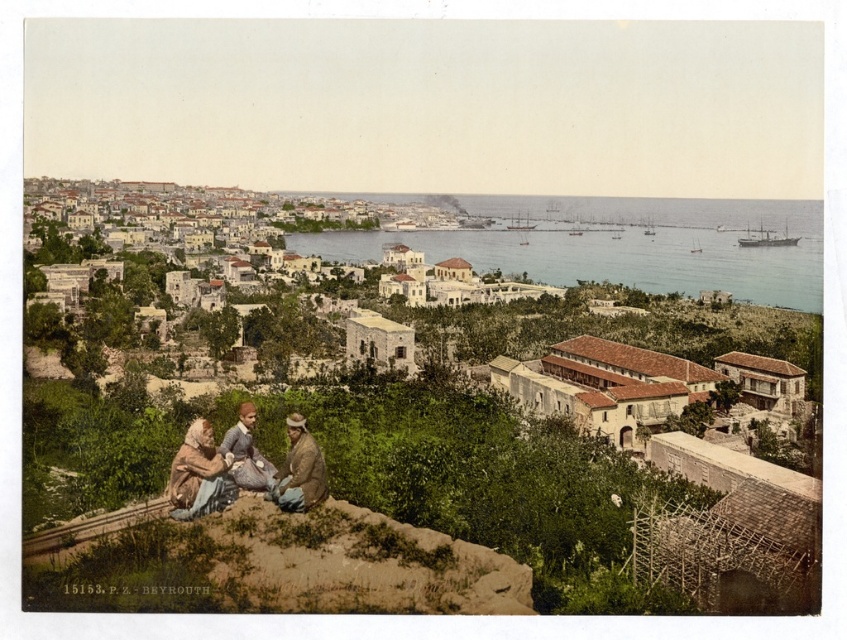
Question: Estimate the real-world distances between objects in this image. Which object is closer to the brown leather jacket at lower left?

Choices:
 (A) light beige stone buildings at center
 (B) blue water at center
 (C) brown leather hat at center

Answer: (C)

Question: Observing the image, what is the correct spatial positioning of light beige stone buildings at center in reference to matte blue dress at lower left?

Choices:
 (A) below
 (B) above

Answer: (B)

Question: Does light beige stone buildings at center come in front of matte blue dress at lower left?

Choices:
 (A) yes
 (B) no

Answer: (B)

Question: Among these objects, which one is farthest from the camera?

Choices:
 (A) matte blue dress at lower left
 (B) brown leather jacket at lower left
 (C) brown leather hat at center
 (D) light beige stone buildings at center

Answer: (D)

Question: Which object appears farthest from the camera in this image?

Choices:
 (A) blue water at center
 (B) light beige stone buildings at center

Answer: (A)

Question: Is matte blue dress at lower left further to the viewer compared to brown leather hat at center?

Choices:
 (A) yes
 (B) no

Answer: (B)